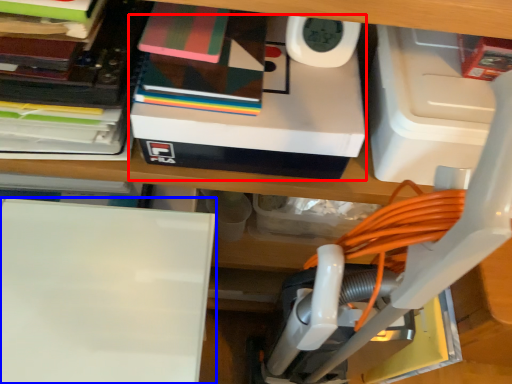
Question: Among these objects, which one is nearest to the camera, box (highlighted by a red box) or wide (highlighted by a blue box)?

Choices:
 (A) box
 (B) wide

Answer: (B)